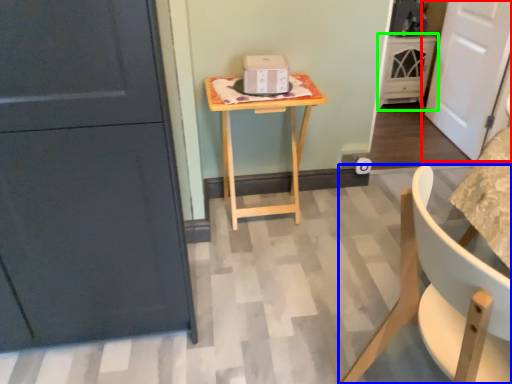
Question: Considering the real-world distances, which object is farthest from door (highlighted by a red box)? chair (highlighted by a blue box) or cabinetry (highlighted by a green box)?

Choices:
 (A) chair
 (B) cabinetry

Answer: (A)